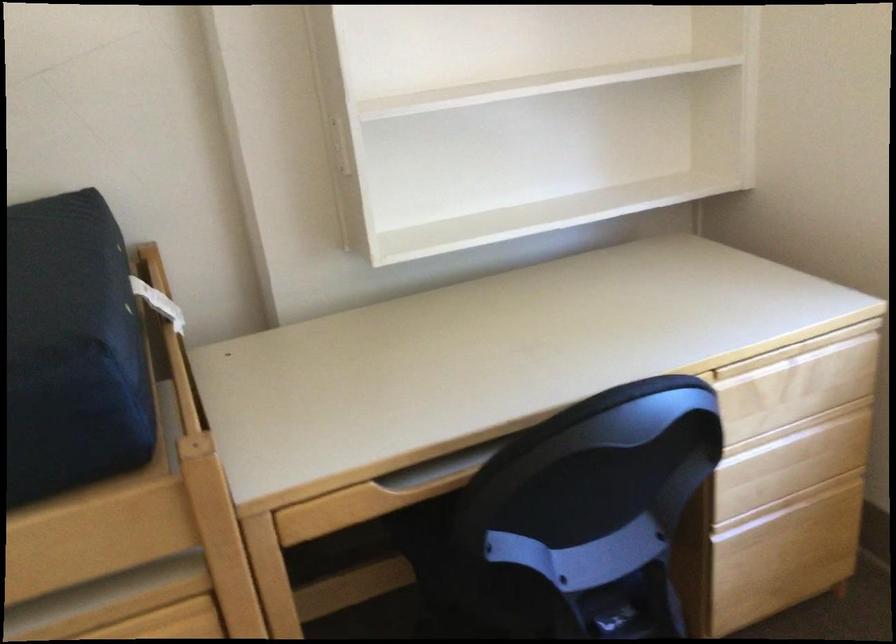
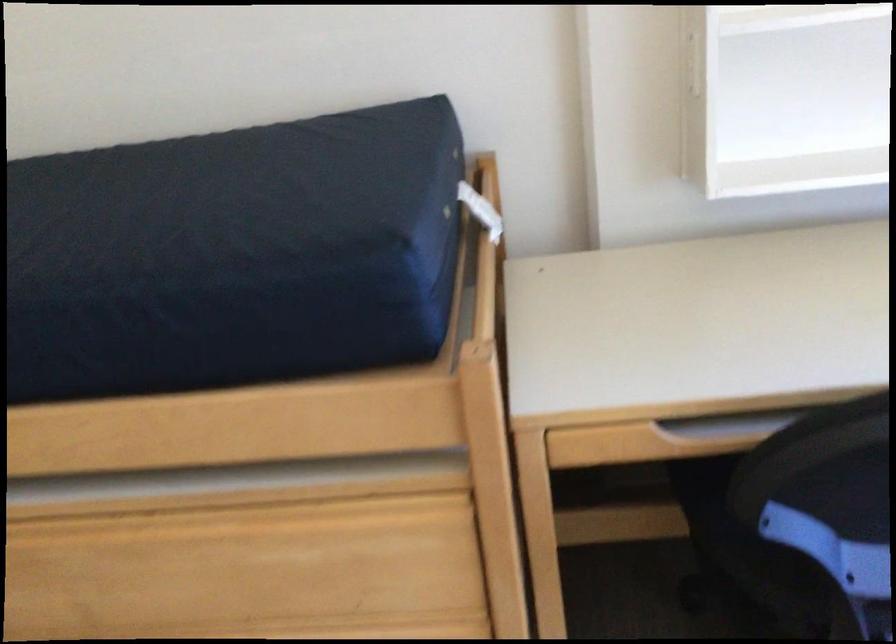
In the second image, find the point that corresponds to point 343,152 in the first image.

(693, 64)